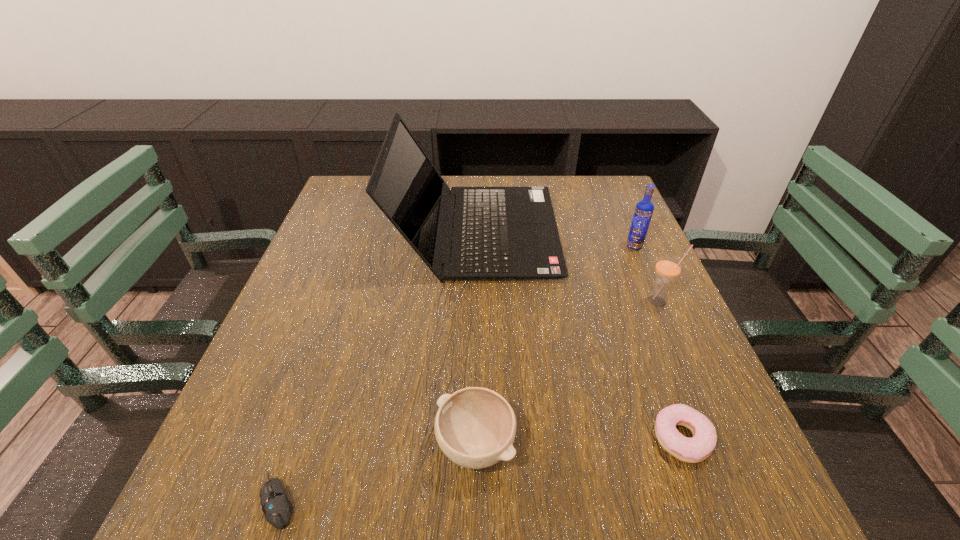
Locate an element on the screen. The image size is (960, 540). object that is at the near left corner is located at coordinates (277, 508).

The image size is (960, 540). I want to click on vacant region at the near edge of the desktop, so click(x=344, y=473).

Image resolution: width=960 pixels, height=540 pixels. In the image, there is a desktop. What are the coordinates of `free region at the left edge` in the screenshot? It's located at (262, 375).

The height and width of the screenshot is (540, 960). I want to click on vacant space at the right edge, so click(x=622, y=249).

I want to click on vacant space at the far left corner, so click(x=348, y=195).

Find the location of a particular element. The image size is (960, 540). free space at the near right corner is located at coordinates (776, 520).

Where is `vacant region between the second shortest object and the straw`? Image resolution: width=960 pixels, height=540 pixels. vacant region between the second shortest object and the straw is located at coordinates (670, 369).

Find the location of a particular element. Image resolution: width=960 pixels, height=540 pixels. free space between the straw and the laptop computer is located at coordinates (567, 267).

Locate an element on the screen. This screenshot has width=960, height=540. vacant point located between the vodka and the computer mouse is located at coordinates (456, 374).

At what (x,y) coordinates should I click in order to perform the action: click on vacant space that's between the fifth tallest object and the laptop computer. Please return your answer as a coordinate pair (x, y). Looking at the image, I should click on tap(579, 335).